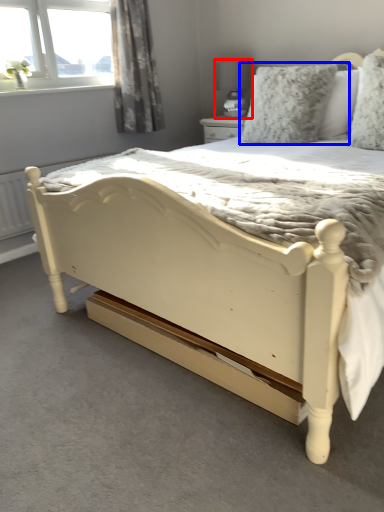
Question: Among these objects, which one is nearest to the camera, lamp (highlighted by a red box) or pillow (highlighted by a blue box)?

Choices:
 (A) lamp
 (B) pillow

Answer: (B)